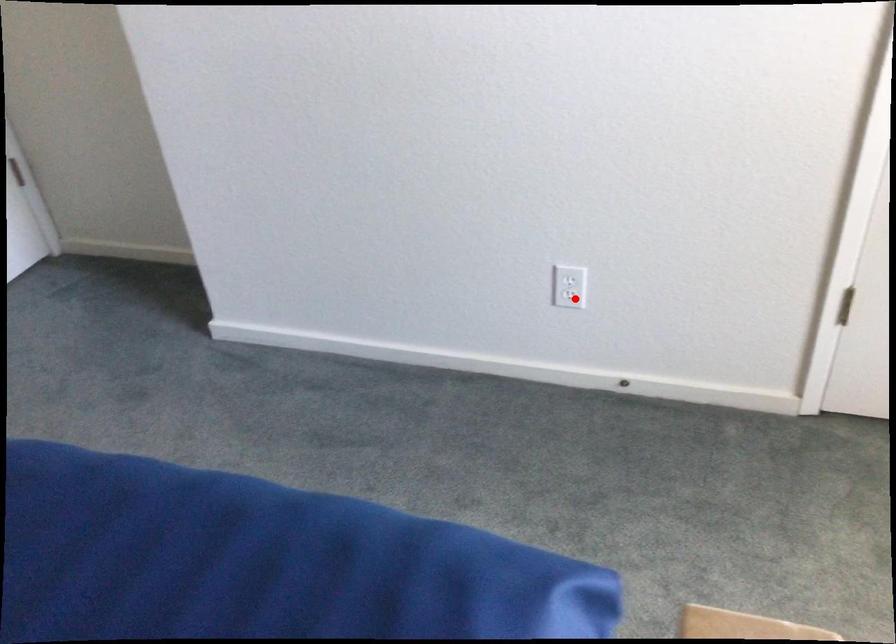
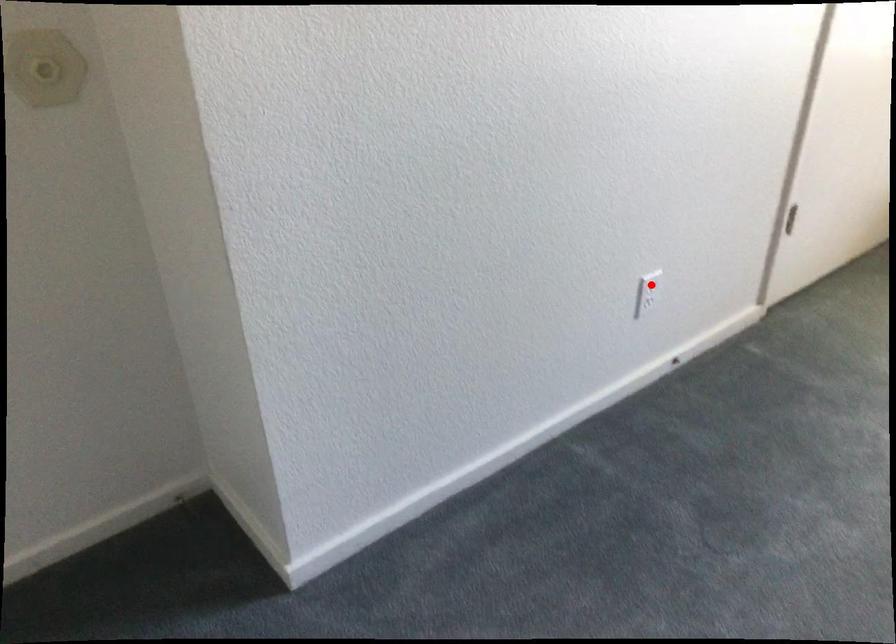
I am providing you with two images of the same scene from different viewpoints. A red point is marked on the first image and another point is marked on the second image. Is the marked point in image1 the same physical position as the marked point in image2?

No